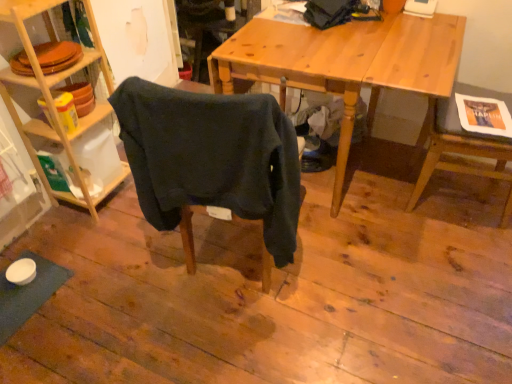
Question: From a real-world perspective, is wooden chair at right, the first chair positioned from the right, above or below woodenshelves at left?

Choices:
 (A) below
 (B) above

Answer: (A)

Question: From their relative heights in the image, would you say wooden chair at right, the first chair positioned from the right, is taller or shorter than woodenshelves at left?

Choices:
 (A) short
 (B) tall

Answer: (A)

Question: Which object is the farthest from the wooden desk at center?

Choices:
 (A) woodenshelves at left
 (B) wooden chair at right, the first chair positioned from the right
 (C) dark blue fabric chair at center, the 2th chair positioned from the right

Answer: (A)

Question: Considering the real-world distances, which object is farthest from the wooden chair at right, the first chair positioned from the right?

Choices:
 (A) wooden desk at center
 (B) dark blue fabric chair at center, the 2th chair positioned from the right
 (C) woodenshelves at left

Answer: (C)